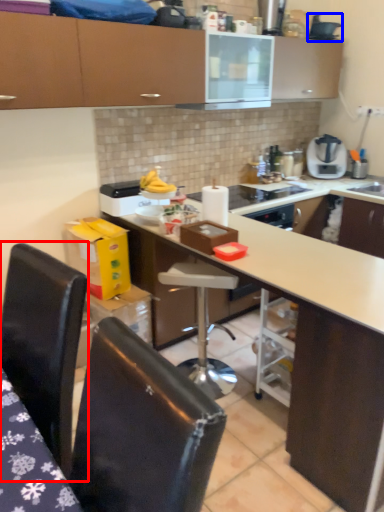
Question: Which of the following is the closest to the observer, chair (highlighted by a red box) or appliance (highlighted by a blue box)?

Choices:
 (A) chair
 (B) appliance

Answer: (A)